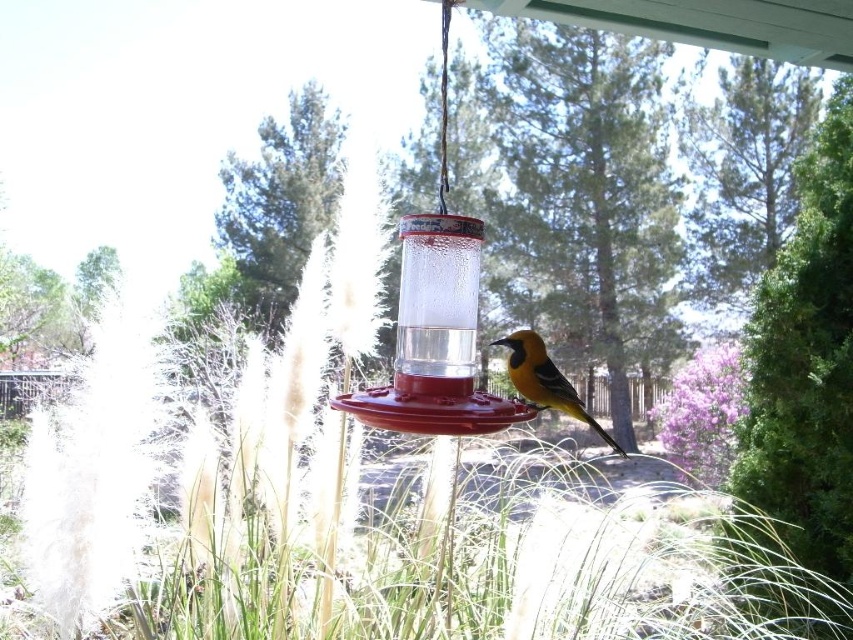
Who is higher up, transparent plastic bird feeder at center or golden-yellow feathers at center?

Positioned higher is transparent plastic bird feeder at center.

Can you confirm if transparent plastic bird feeder at center is smaller than golden-yellow feathers at center?

Correct, transparent plastic bird feeder at center occupies less space than golden-yellow feathers at center.

Who is more forward, (x=434, y=392) or (x=555, y=392)?

Point (x=434, y=392) is more forward.

Find the location of a particular element. Image resolution: width=853 pixels, height=640 pixels. transparent plastic bird feeder at center is located at coordinates (434, 339).